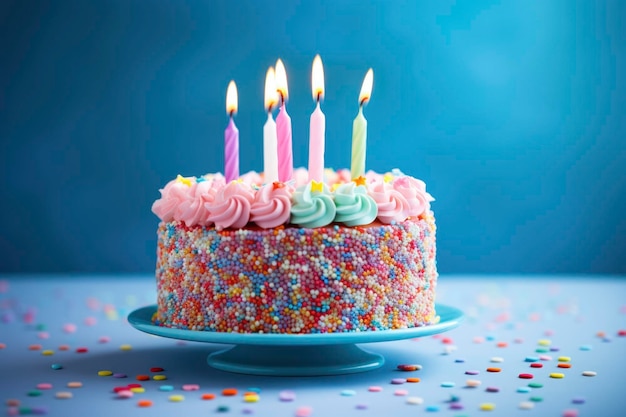
Find the location of a particular element. The height and width of the screenshot is (417, 626). birthday candle is located at coordinates pos(228,157), pos(270,152), pos(287,133), pos(317,137), pos(361,150).